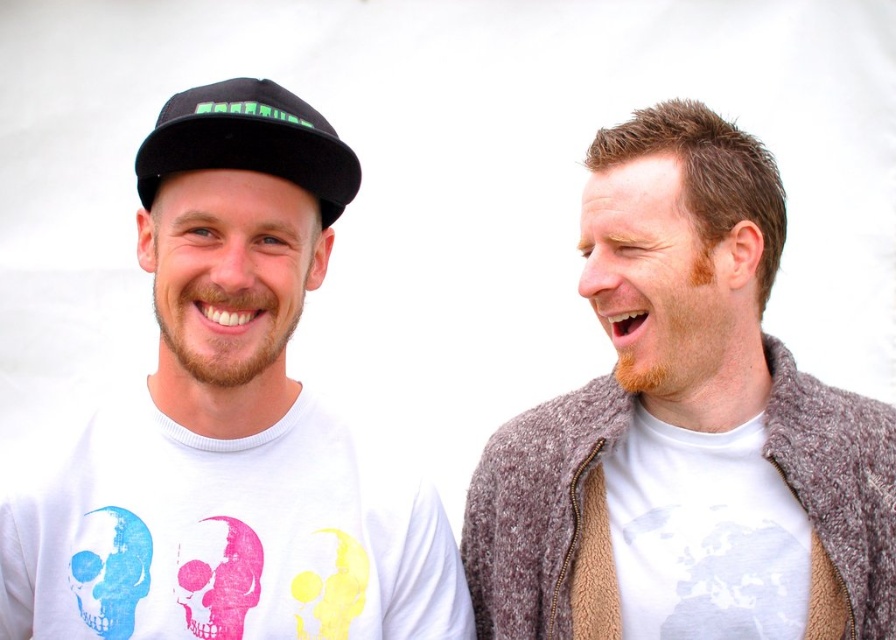
In the scene shown: Who is shorter, white cotton t-shirt at center or blue matte skull at left?

With less height is blue matte skull at left.

Does point (894, 608) come closer to viewer compared to point (93, 550)?

No, (894, 608) is behind (93, 550).

Between point (788, 410) and point (125, 600), which one is positioned in front?

Positioned in front is point (125, 600).

Identify the location of white cotton t-shirt at center. (685, 429).

Is point (643, 240) farther from camera compared to point (332, 186)?

No, it is in front of (332, 186).

Who is lower down, white cotton t-shirt at center or black matte cap at upper left?

white cotton t-shirt at center is below.

Does point (625, 273) lie behind point (186, 93)?

Yes, it is behind point (186, 93).

Identify the location of white cotton t-shirt at center. This screenshot has height=640, width=896. [685, 429].

Can you confirm if white matte t-shirt at left is positioned to the right of pink matte skull at left?

Correct, you'll find white matte t-shirt at left to the right of pink matte skull at left.

The width and height of the screenshot is (896, 640). What do you see at coordinates (238, 403) in the screenshot?
I see `white matte t-shirt at left` at bounding box center [238, 403].

Where is `white matte t-shirt at left`? The image size is (896, 640). white matte t-shirt at left is located at coordinates (238, 403).

You are a GUI agent. You are given a task and a screenshot of the screen. Output one action in this format:
    pyautogui.click(x=<x>, y=<y>)
    Task: Click on the white matte t-shirt at left
    The width and height of the screenshot is (896, 640).
    Given the screenshot: What is the action you would take?
    pyautogui.click(x=238, y=403)